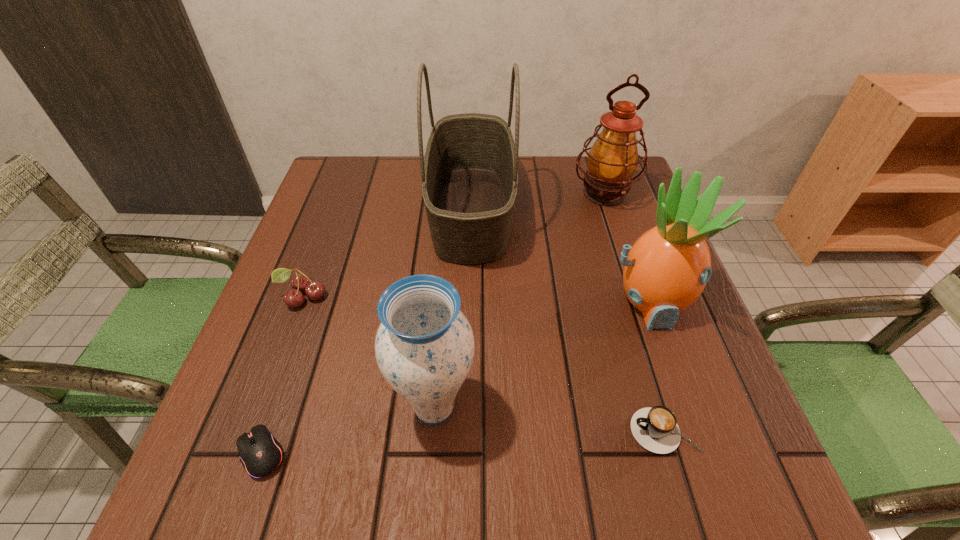
Find the location of a particular element. vacant region that satisfies the following two spatial constraints: 1. at the entrance of the pineapple; 2. with the handle on the side of the sixth tallest object is located at coordinates (695, 431).

Where is `vacant space that satisfies the following two spatial constraints: 1. on the leaves of the third shortest object; 2. on the right side of the vase`? The image size is (960, 540). vacant space that satisfies the following two spatial constraints: 1. on the leaves of the third shortest object; 2. on the right side of the vase is located at coordinates (262, 408).

This screenshot has height=540, width=960. Find the location of `free region that satisfies the following two spatial constraints: 1. at the entrance of the pineapple; 2. with the handle on the side of the second shortest object`. free region that satisfies the following two spatial constraints: 1. at the entrance of the pineapple; 2. with the handle on the side of the second shortest object is located at coordinates (695, 431).

Identify the location of vacant area that satisfies the following two spatial constraints: 1. on the back side of the shortest object; 2. on the right side of the vase. Image resolution: width=960 pixels, height=540 pixels. (276, 408).

Find the location of a particular element. This screenshot has width=960, height=540. blank area in the image that satisfies the following two spatial constraints: 1. on the leaves of the shortest object; 2. on the right side of the fifth tallest object is located at coordinates (245, 453).